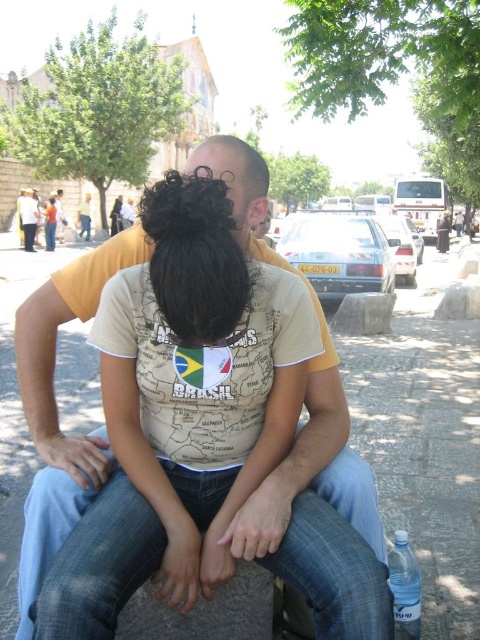
Question: Which of these objects is positioned closest to the white cotton shirt at center?

Choices:
 (A) transparent plastic bottle at lower right
 (B) yellow cotton shirt at center

Answer: (B)

Question: Is yellow cotton shirt at center wider than white cotton shirt at center?

Choices:
 (A) no
 (B) yes

Answer: (B)

Question: Which point is closer to the camera?

Choices:
 (A) pos(48,410)
 (B) pos(396,634)
 (C) pos(54,200)

Answer: (A)

Question: Does transparent plastic bottle at lower right come behind white cotton shirt at center?

Choices:
 (A) no
 (B) yes

Answer: (A)

Question: Estimate the real-world distances between objects in this image. Which object is farther from the transparent plastic bottle at lower right?

Choices:
 (A) yellow cotton shirt at center
 (B) white cotton shirt at center

Answer: (B)

Question: Is transparent plastic bottle at lower right thinner than white cotton shirt at center?

Choices:
 (A) no
 (B) yes

Answer: (B)